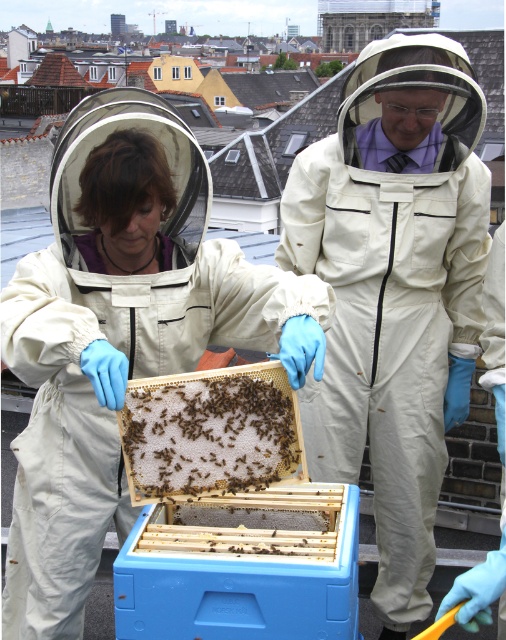
Between beige fabric beekeeper suit at center and white fabric beekeeper suit at center, which one has less height?

Standing shorter between the two is beige fabric beekeeper suit at center.

Can you confirm if beige fabric beekeeper suit at center is positioned to the right of white fabric beekeeper suit at center?

Incorrect, beige fabric beekeeper suit at center is not on the right side of white fabric beekeeper suit at center.

Which is in front, point (5, 620) or point (446, 268)?

Positioned in front is point (5, 620).

This screenshot has width=506, height=640. In order to click on beige fabric beekeeper suit at center in this screenshot , I will do `click(120, 333)`.

Who is taller, beige fabric beekeeper suit at center or brown fuzzy honeycomb at center?

beige fabric beekeeper suit at center is taller.

Find the location of `beige fabric beekeeper suit at center`. beige fabric beekeeper suit at center is located at coordinates (120, 333).

Is point (227, 381) positioned in front of point (274, 435)?

Yes, point (227, 381) is closer to viewer.

Between brown wax comb at center and brown fuzzy honeycomb at center, which one is positioned higher?

brown fuzzy honeycomb at center

Which is in front, point (181, 573) or point (186, 481)?

Point (181, 573) is in front.

This screenshot has height=640, width=506. What are the coordinates of `brown wax comb at center` in the screenshot? It's located at (230, 515).